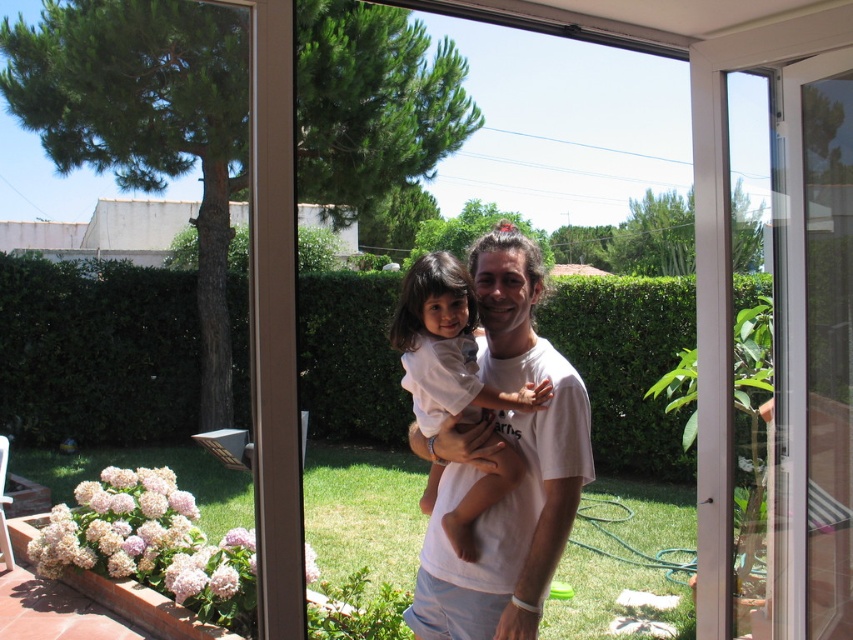
Is white plastic screen door at right to the right of transparent glass door at center from the viewer's perspective?

Correct, you'll find white plastic screen door at right to the right of transparent glass door at center.

Where is `white plastic screen door at right`? white plastic screen door at right is located at coordinates (809, 356).

What do you see at coordinates (809, 356) in the screenshot? I see `white plastic screen door at right` at bounding box center [809, 356].

Identify the location of white plastic screen door at right. (809, 356).

Locate an element on the screen. The image size is (853, 640). white plastic screen door at right is located at coordinates (809, 356).

Can you confirm if white plastic screen door at right is positioned below white cotton shirt at center?

Incorrect, white plastic screen door at right is not positioned below white cotton shirt at center.

Which is in front, point (804, 611) or point (454, 401)?

Point (454, 401) is in front.

I want to click on white plastic screen door at right, so click(809, 356).

Which of these two, transparent glass door at center or white cotton shirt at center, stands taller?

Standing taller between the two is transparent glass door at center.

Which of these two, transparent glass door at center or white cotton shirt at center, stands shorter?

With less height is white cotton shirt at center.

Is point (534, 637) positioned before point (428, 403)?

Yes, it is.

The image size is (853, 640). Identify the location of transparent glass door at center. (552, 22).